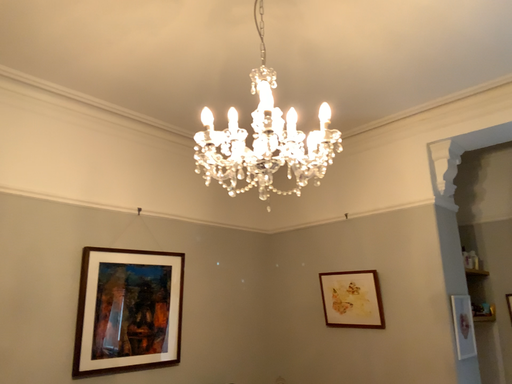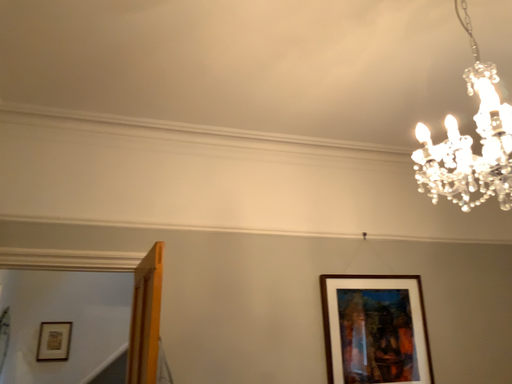
Question: Which way did the camera rotate in the video?

Choices:
 (A) rotated right
 (B) rotated left

Answer: (B)